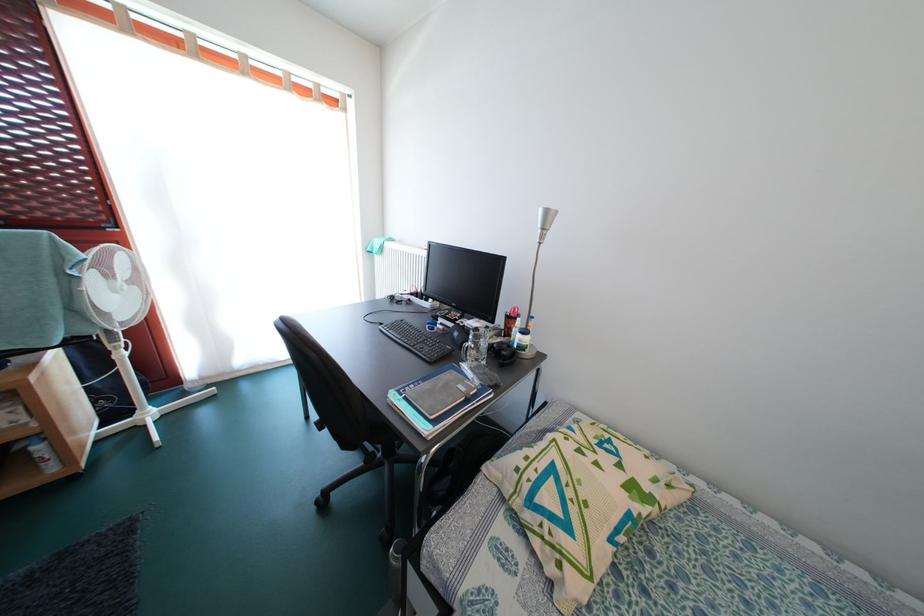
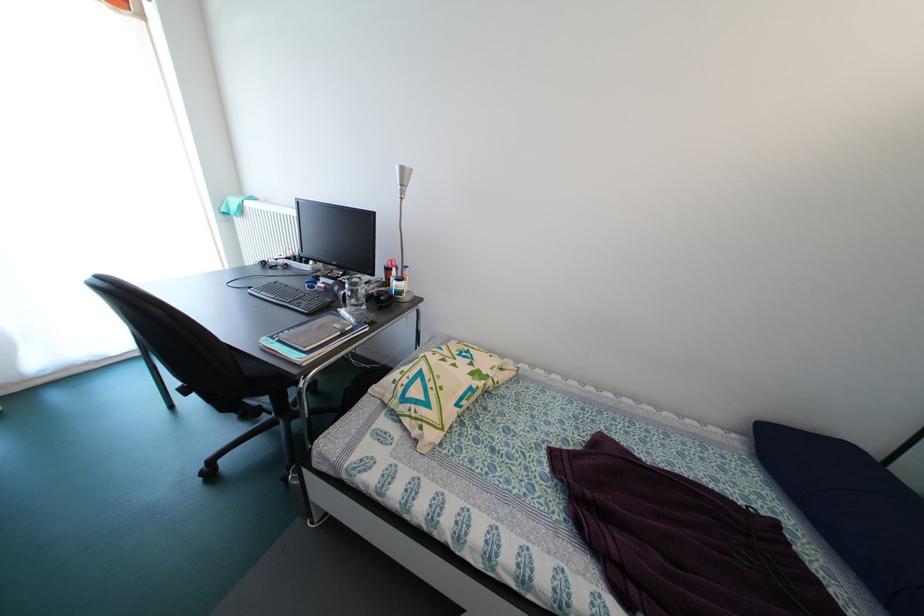
In the second image, find the point that corresponds to point 453,392 in the first image.

(327, 331)